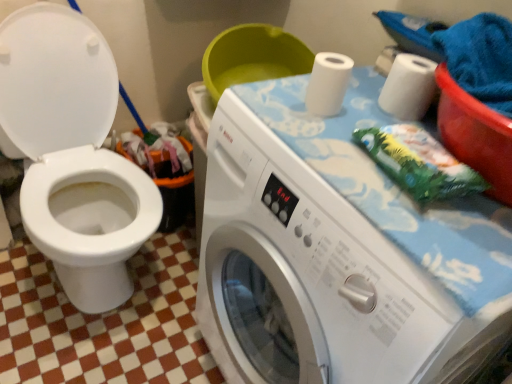
Question: Looking at their shapes, would you say white glossy toilet at left is wider or thinner than white matte toilet paper at upper right, which is the 1th toilet paper in left-to-right order?

Choices:
 (A) thin
 (B) wide

Answer: (B)

Question: Which is correct: white glossy toilet at left is inside white matte toilet paper at upper right, which is the 1th toilet paper in left-to-right order, or outside of it?

Choices:
 (A) outside
 (B) inside

Answer: (A)

Question: Which of these objects is positioned farthest from the orange plastic recycling bin at lower left?

Choices:
 (A) white matte toilet paper at upper right, the 2th toilet paper in the right-to-left sequence
 (B) white plastic washing machine at center
 (C) white glossy toilet at left
 (D) green fabric at upper right
 (E) white matte toilet paper at upper right, marked as the 2th toilet paper in a left-to-right arrangement

Answer: (D)

Question: Which of these objects is positioned closest to the white glossy toilet at left?

Choices:
 (A) green fabric at upper right
 (B) white matte toilet paper at upper right, the first toilet paper from the right
 (C) white plastic washing machine at center
 (D) orange plastic recycling bin at lower left
 (E) white matte toilet paper at upper right, which is the 1th toilet paper in left-to-right order

Answer: (D)